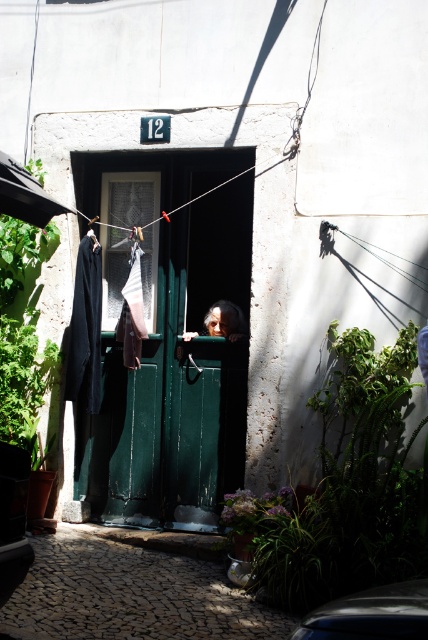
Question: Which point is farther to the camera?

Choices:
 (A) shiny silver car at lower center
 (B) green leafy plant at center
 (C) dark gray fabric at left
 (D) smooth skin face at center

Answer: (C)

Question: Where is green matte door at center located in relation to cobblestone alley at lower center in the image?

Choices:
 (A) below
 (B) above

Answer: (B)

Question: Can you confirm if shiny silver car at lower center is positioned above striped fabric at center?

Choices:
 (A) yes
 (B) no

Answer: (B)

Question: Which object is farther from the camera taking this photo?

Choices:
 (A) dark gray fabric at left
 (B) green leafy plant at lower left
 (C) striped fabric at center

Answer: (A)

Question: Is green leafy plant at center wider than cobblestone alley at lower center?

Choices:
 (A) no
 (B) yes

Answer: (A)

Question: Considering the real-world distances, which object is closest to the cobblestone alley at lower center?

Choices:
 (A) dark gray fabric at left
 (B) striped fabric at center

Answer: (A)